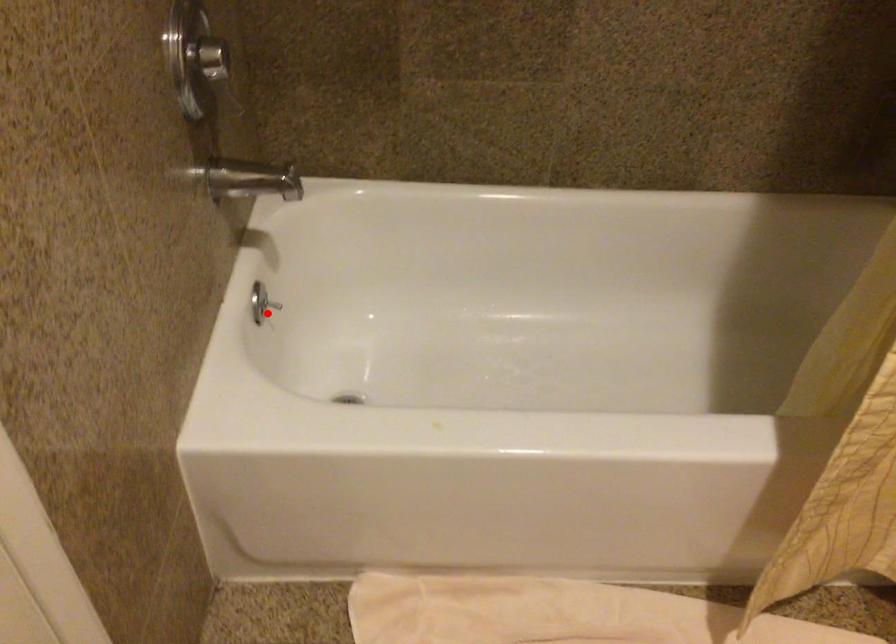
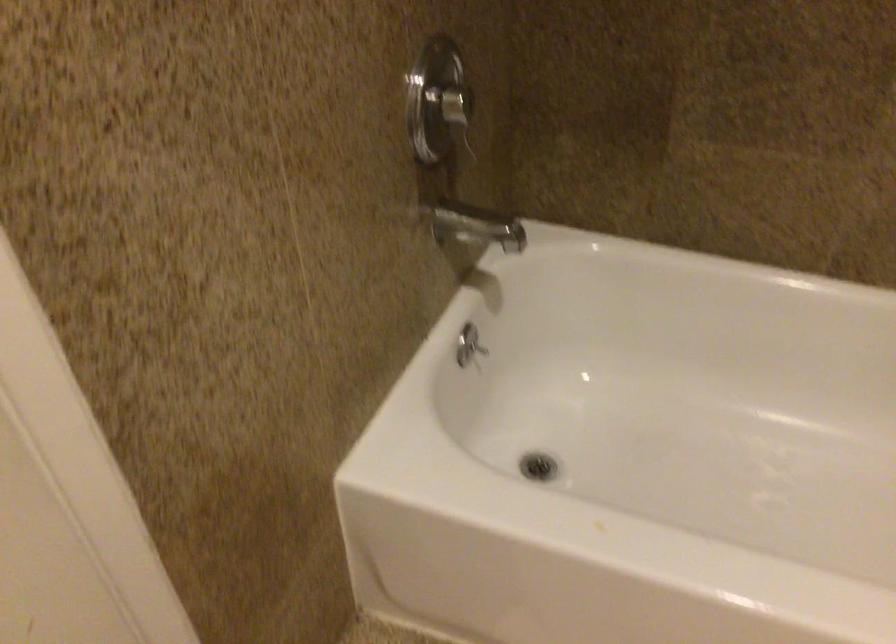
In the second image, find the point that corresponds to the highlighted location in the first image.

(478, 348)